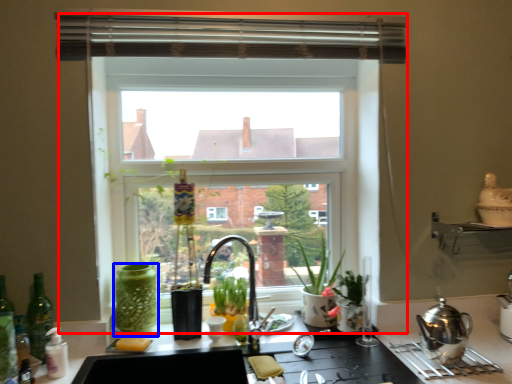
Question: Which object appears farthest to the camera in this image, window (highlighted by a red box) or glass vase (highlighted by a blue box)?

Choices:
 (A) window
 (B) glass vase

Answer: (A)